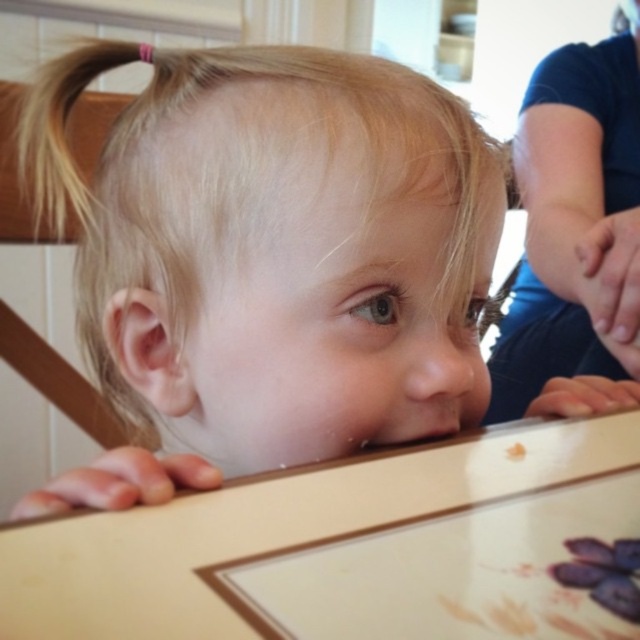
Which is more to the left, blue denim jeans at upper right or purple matte grapes at upper center?

purple matte grapes at upper center is more to the left.

Locate an element on the screen. blue denim jeans at upper right is located at coordinates (573, 225).

Is wooden table at lower center wider than purple matte grapes at upper center?

Yes.

Between wooden table at lower center and purple matte grapes at upper center, which one has more height?

With more height is wooden table at lower center.

This screenshot has height=640, width=640. Find the location of `wooden table at lower center`. wooden table at lower center is located at coordinates (344, 545).

Image resolution: width=640 pixels, height=640 pixels. What are the coordinates of `wooden table at lower center` in the screenshot? It's located at (344, 545).

Measure the distance between point [282,532] and camera.

Point [282,532] and camera are 9.99 inches apart from each other.

Who is more distant from viewer, (4, 586) or (588, 333)?

The point (588, 333) is more distant.

Locate an element on the screen. wooden table at lower center is located at coordinates (344, 545).